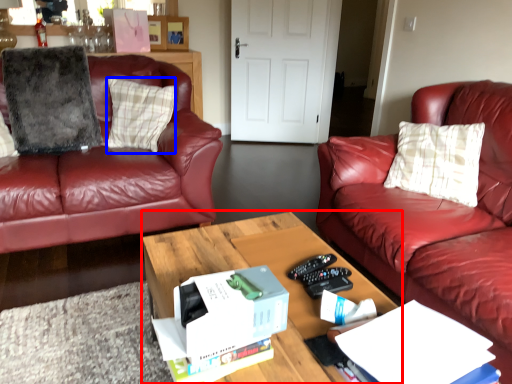
Question: Which object appears farthest to the camera in this image, coffee table (highlighted by a red box) or pillow (highlighted by a blue box)?

Choices:
 (A) coffee table
 (B) pillow

Answer: (B)